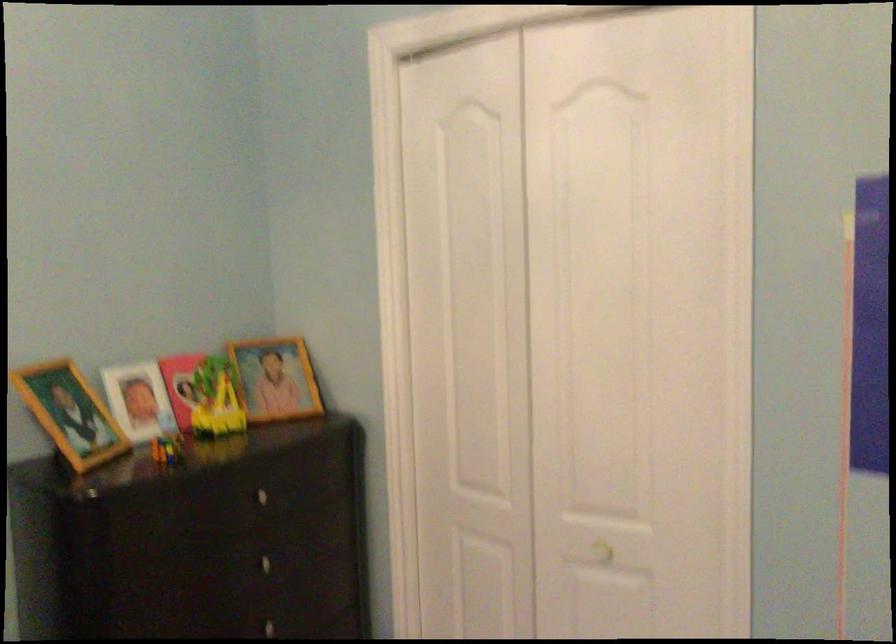
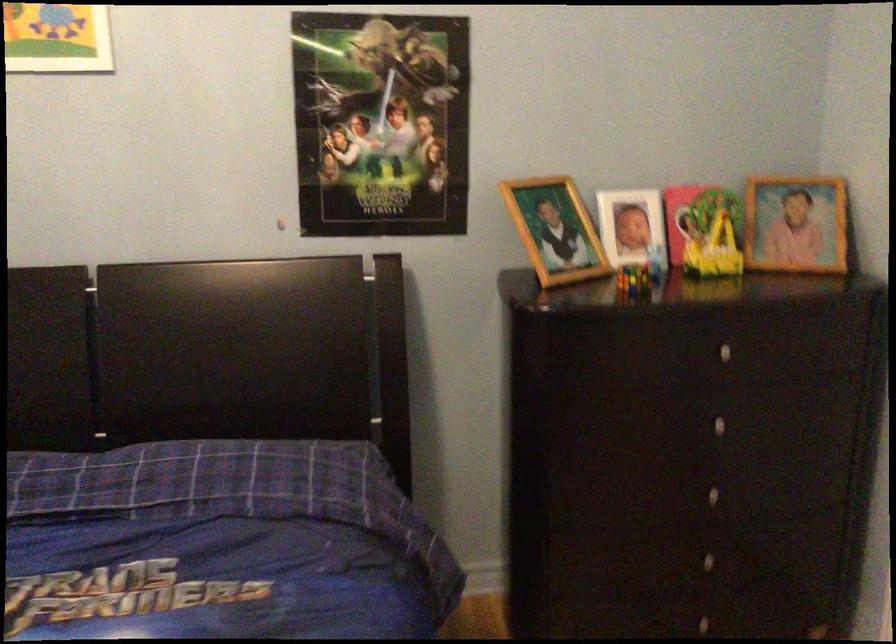
Question: The first image is from the beginning of the video and the second image is from the end. How did the camera likely rotate when shooting the video?

Choices:
 (A) Left
 (B) Right
 (C) Up
 (D) Down

Answer: (A)